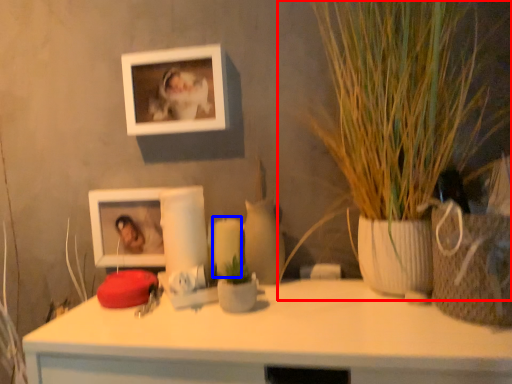
Question: Which of the following is the closest to the observer, houseplant (highlighted by a red box) or candle (highlighted by a blue box)?

Choices:
 (A) houseplant
 (B) candle

Answer: (A)